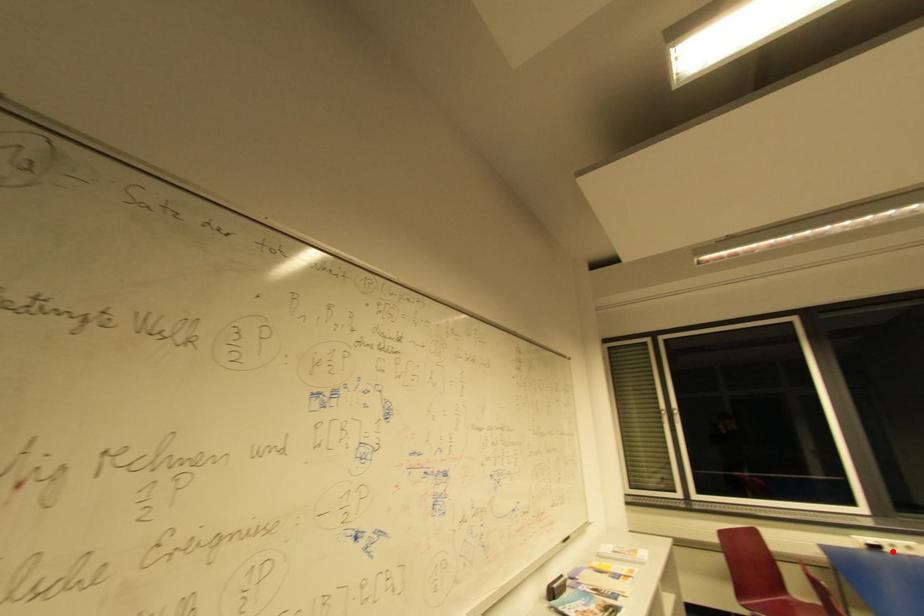
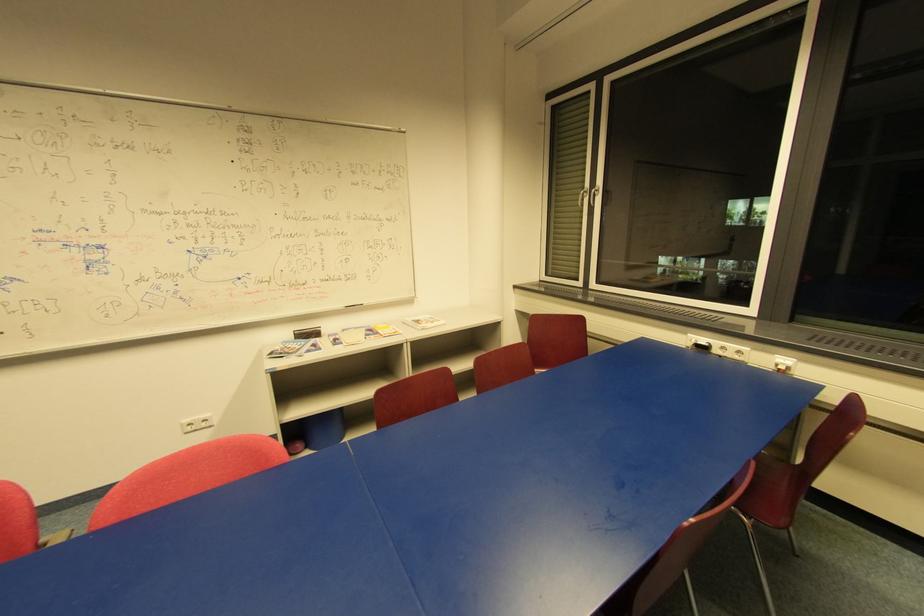
In the second image, find the point that corresponds to the highlighted location in the first image.

(720, 352)